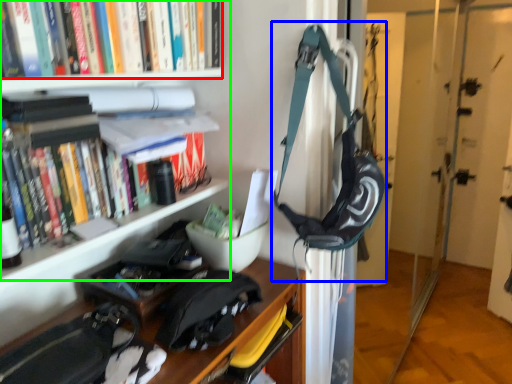
Question: Which object is positioned farthest from book (highlighted by a red box)? Select from shoulder bag (highlighted by a blue box) and bookcase (highlighted by a green box).

Choices:
 (A) shoulder bag
 (B) bookcase

Answer: (A)